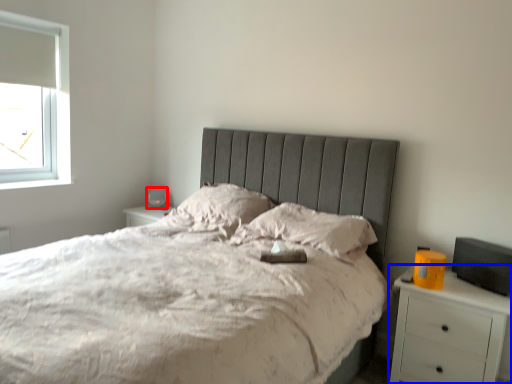
Question: Which of the following is the farthest to the observer, table lamp (highlighted by a red box) or nightstand (highlighted by a blue box)?

Choices:
 (A) table lamp
 (B) nightstand

Answer: (A)